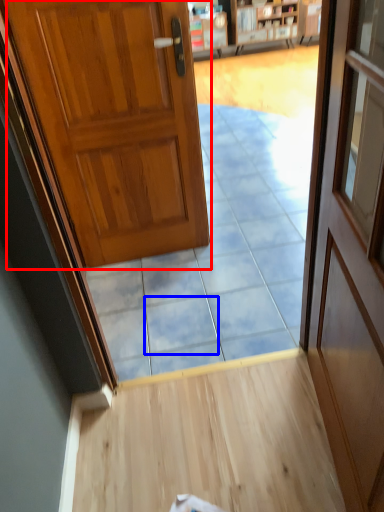
Question: Among these objects, which one is farthest to the camera, door (highlighted by a red box) or tile (highlighted by a blue box)?

Choices:
 (A) door
 (B) tile

Answer: (B)